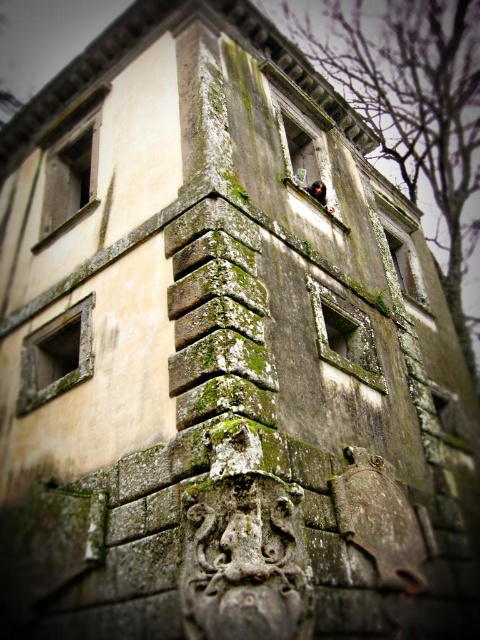
You are standing in front of the historical stone building and notice two points marked on its facade. The first point is at coordinate [323,132] and the second at [60,168]. Which of these points is closer to you?

Point [323,132] is closer to you because it is further to the viewer than point [60,168].

You are an architect examining the building and need to compare the windows. Which of the two windows, the green mossy stone window at center or the matte stone window at upper left, is shorter in height?

The green mossy stone window at center is not as tall as the matte stone window at upper left, so it is shorter in height.